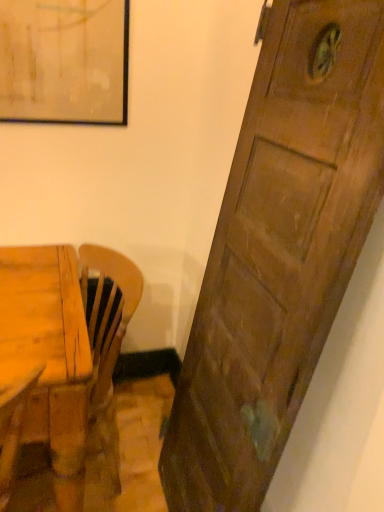
What do you see at coordinates (61, 350) in the screenshot? I see `wooden chair at lower left` at bounding box center [61, 350].

You are a GUI agent. You are given a task and a screenshot of the screen. Output one action in this format:
    pyautogui.click(x=<x>, y=<y>)
    Task: Click on the wooden chair at lower left
    The width and height of the screenshot is (384, 512).
    Given the screenshot: What is the action you would take?
    pyautogui.click(x=61, y=350)

At what (x,y) coordinates should I click in order to perform the action: click on wooden chair at lower left. Please return your answer as a coordinate pair (x, y). This screenshot has height=512, width=384. Looking at the image, I should click on (61, 350).